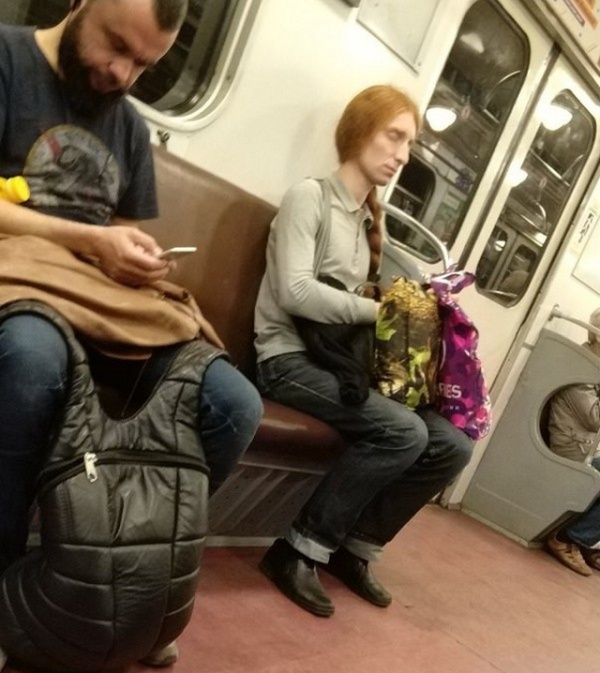
Find the location of `redish floor`. redish floor is located at coordinates coord(241,594).